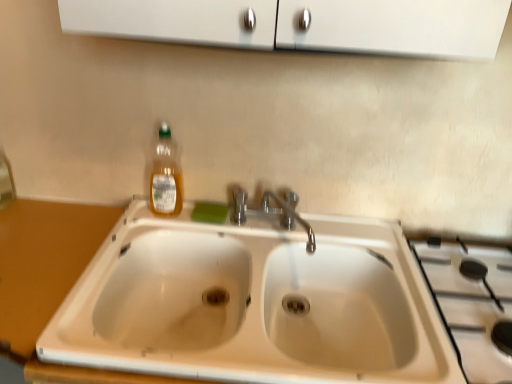
Measure the distance between point (483,348) and camera.

The depth of point (483,348) is 88.60 centimeters.

Describe the element at coordinates (472, 303) in the screenshot. I see `white ceramic gas stove at right` at that location.

Measure the distance between point (54,358) and camera.

The depth of point (54,358) is 30.47 inches.

Identify the location of white ceramic gas stove at right. This screenshot has width=512, height=384. [x=472, y=303].

Would you say translucent plastic bottle at upper left is to the left or to the right of wooden counter at lower left in the picture?

Clearly, translucent plastic bottle at upper left is on the right of wooden counter at lower left in the image.

How many degrees apart are the facing directions of translucent plastic bottle at upper left and wooden counter at lower left?

There is a 2.25-degree angle between the facing directions of translucent plastic bottle at upper left and wooden counter at lower left.

Is translucent plastic bottle at upper left turned away from wooden counter at lower left?

translucent plastic bottle at upper left is not turned away from wooden counter at lower left.

At what (x,y) coordinates should I click in order to perform the action: click on counter top that is in front of the translucent plastic bottle at upper left. Please return your answer as a coordinate pair (x, y). Image resolution: width=512 pixels, height=384 pixels. Looking at the image, I should click on (42, 263).

From the image's perspective, is white ceramic gas stove at right positioned above or below translucent plastic bottle at upper left?

Clearly, from the image's perspective, white ceramic gas stove at right is below translucent plastic bottle at upper left.

In the image, there is a translucent plastic bottle at upper left. In order to click on gas stove below it (from a real-world perspective) in this screenshot , I will do `click(472, 303)`.

Is white ceramic gas stove at right smaller than translucent plastic bottle at upper left?

No.

Is white ceramic gas stove at right next to translucent plastic bottle at upper left?

No, white ceramic gas stove at right is not beside translucent plastic bottle at upper left.

Relative to wooden counter at lower left, is white ceramic gas stove at right in front or behind?

white ceramic gas stove at right is positioned farther from the viewer than wooden counter at lower left.

Which is in front, point (465, 313) or point (42, 293)?

The point (42, 293) is in front.

Between white ceramic gas stove at right and wooden counter at lower left, which one has less height?

Standing shorter between the two is white ceramic gas stove at right.

Is white ceramic gas stove at right positioned far away from wooden counter at lower left?

No, white ceramic gas stove at right is in close proximity to wooden counter at lower left.

From a real-world perspective, is translucent plastic bottle at upper left above or below green sponge at sink?

translucent plastic bottle at upper left is above green sponge at sink.

Is translucent plastic bottle at upper left smaller than green sponge at sink?

Actually, translucent plastic bottle at upper left might be larger than green sponge at sink.

Which is correct: translucent plastic bottle at upper left is inside green sponge at sink, or outside of it?

translucent plastic bottle at upper left is spatially situated outside green sponge at sink.

In the scene shown: Can you tell me how much translucent plastic bottle at upper left and green sponge at sink differ in facing direction?

There is a 4.26-degree angle between the facing directions of translucent plastic bottle at upper left and green sponge at sink.

In the scene shown: Which of these two, wooden counter at lower left or translucent plastic bottle at upper left, is bigger?

wooden counter at lower left.

From a real-world perspective, which object stands above the other?

From a 3D spatial view, translucent plastic bottle at upper left is above.

Can you confirm if wooden counter at lower left is wider than translucent plastic bottle at upper left?

Indeed, wooden counter at lower left has a greater width compared to translucent plastic bottle at upper left.

Considering the relative sizes of wooden counter at lower left and translucent plastic bottle at upper left in the image provided, is wooden counter at lower left taller than translucent plastic bottle at upper left?

Yes.

How far apart are translucent plastic bottle at upper left and white ceramic sink at center?

14.57 inches.

Is translucent plastic bottle at upper left at the right side of white ceramic sink at center?

No, translucent plastic bottle at upper left is not to the right of white ceramic sink at center.

Is translucent plastic bottle at upper left not near white ceramic sink at center?

No, there isn't a large distance between translucent plastic bottle at upper left and white ceramic sink at center.

Does translucent plastic bottle at upper left turn towards white ceramic sink at center?

No, translucent plastic bottle at upper left is not oriented towards white ceramic sink at center.

Which of these two, wooden counter at lower left or white ceramic gas stove at right, stands shorter?

white ceramic gas stove at right.

Does point (11, 207) lie in front of point (474, 375)?

No, (11, 207) is further to viewer.

Is wooden counter at lower left positioned with its back to white ceramic gas stove at right?

No, wooden counter at lower left is not facing the opposite direction of white ceramic gas stove at right.

Looking at the image, does wooden counter at lower left seem bigger or smaller compared to white ceramic gas stove at right?

In the image, wooden counter at lower left appears to be larger than white ceramic gas stove at right.

Find the location of a particular element. counter top to the left of translucent plastic bottle at upper left is located at coordinates (42, 263).

What are the coordinates of `gas stove below the translucent plastic bottle at upper left (from the image's perspective)` in the screenshot? It's located at (472, 303).

Considering their positions, is green sponge at sink positioned closer to translucent plastic bottle at upper left than white ceramic gas stove at right?

green sponge at sink.

When comparing their distances from white ceramic gas stove at right, does green sponge at sink or translucent plastic bottle at upper left seem further?

translucent plastic bottle at upper left is further to white ceramic gas stove at right.

Based on their spatial positions, is green sponge at sink or white ceramic sink at center closer to white ceramic gas stove at right?

white ceramic sink at center is positioned closer to the anchor white ceramic gas stove at right.

Based on their spatial positions, is white ceramic gas stove at right or wooden counter at lower left further from translucent plastic bottle at upper left?

The object further to translucent plastic bottle at upper left is white ceramic gas stove at right.

From the image, which object appears to be farther from white ceramic sink at center, green sponge at sink or translucent plastic bottle at upper left?

translucent plastic bottle at upper left lies further to white ceramic sink at center than the other object.

In the scene shown: Estimate the real-world distances between objects in this image. Which object is closer to translucent plastic bottle at upper left, white ceramic gas stove at right or green sponge at sink?

Among the two, green sponge at sink is located nearer to translucent plastic bottle at upper left.

From the image, which object appears to be nearer to green sponge at sink, white ceramic sink at center or wooden counter at lower left?

The object closer to green sponge at sink is white ceramic sink at center.

Which object lies further to the anchor point translucent plastic bottle at upper left, wooden counter at lower left or white ceramic sink at center?

white ceramic sink at center.

You are a GUI agent. You are given a task and a screenshot of the screen. Output one action in this format:
    pyautogui.click(x=<x>, y=<y>)
    Task: Click on the soap situated between translucent plastic bottle at upper left and white ceramic gas stove at right from left to right
    The height and width of the screenshot is (384, 512).
    Given the screenshot: What is the action you would take?
    pyautogui.click(x=209, y=212)

What are the coordinates of `sink located between green sponge at sink and white ceramic gas stove at right in the left-right direction` in the screenshot? It's located at (253, 303).

The image size is (512, 384). In order to click on soap between wooden counter at lower left and white ceramic gas stove at right from left to right in this screenshot , I will do `click(209, 212)`.

Find the location of a particular element. The image size is (512, 384). bottle positioned between white ceramic sink at center and green sponge at sink from near to far is located at coordinates coord(166,177).